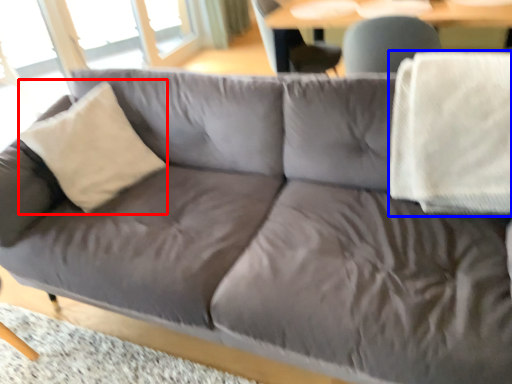
Question: Which of the following is the closest to the observer, throw pillow (highlighted by a red box) or blanket (highlighted by a blue box)?

Choices:
 (A) throw pillow
 (B) blanket

Answer: (B)